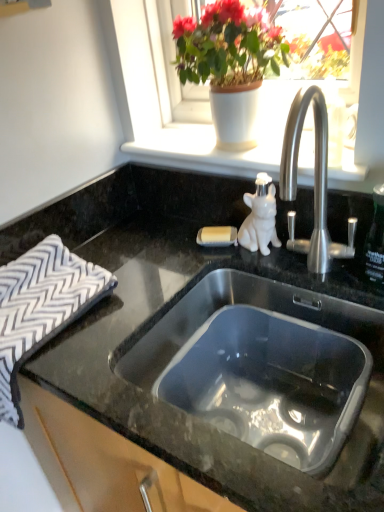
Question: Is matte white pot at upper center oriented towards white zigzag-patterned cloth at left?

Choices:
 (A) no
 (B) yes

Answer: (A)

Question: Can you confirm if matte white pot at upper center is positioned to the left of white zigzag-patterned cloth at left?

Choices:
 (A) no
 (B) yes

Answer: (A)

Question: Is matte white pot at upper center shorter than white zigzag-patterned cloth at left?

Choices:
 (A) yes
 (B) no

Answer: (B)

Question: Is matte white pot at upper center in front of white zigzag-patterned cloth at left?

Choices:
 (A) no
 (B) yes

Answer: (A)

Question: Would you say matte white pot at upper center is a long distance from white zigzag-patterned cloth at left?

Choices:
 (A) no
 (B) yes

Answer: (A)

Question: Considering the relative positions of white matte window sill at upper center and black granite countertop at center in the image provided, is white matte window sill at upper center to the left or to the right of black granite countertop at center?

Choices:
 (A) left
 (B) right

Answer: (B)

Question: Is white matte window sill at upper center bigger or smaller than black granite countertop at center?

Choices:
 (A) big
 (B) small

Answer: (B)

Question: From their relative heights in the image, would you say white matte window sill at upper center is taller or shorter than black granite countertop at center?

Choices:
 (A) tall
 (B) short

Answer: (B)

Question: In the image, is white matte window sill at upper center positioned in front of or behind black granite countertop at center?

Choices:
 (A) behind
 (B) front

Answer: (A)

Question: Is stainless steel sink at center spatially inside white matte window sill at upper center, or outside of it?

Choices:
 (A) outside
 (B) inside

Answer: (A)

Question: In terms of height, does stainless steel sink at center look taller or shorter compared to white matte window sill at upper center?

Choices:
 (A) tall
 (B) short

Answer: (A)

Question: Considering their positions, is stainless steel sink at center located in front of or behind white matte window sill at upper center?

Choices:
 (A) behind
 (B) front

Answer: (B)

Question: Considering the relative positions of stainless steel sink at center and white matte window sill at upper center in the image provided, is stainless steel sink at center to the left or to the right of white matte window sill at upper center?

Choices:
 (A) left
 (B) right

Answer: (B)

Question: Considering the relative positions of black granite countertop at center and white matte window sill at upper center in the image provided, is black granite countertop at center to the left or to the right of white matte window sill at upper center?

Choices:
 (A) right
 (B) left

Answer: (B)

Question: Looking at the image, does black granite countertop at center seem bigger or smaller compared to white matte window sill at upper center?

Choices:
 (A) small
 (B) big

Answer: (B)